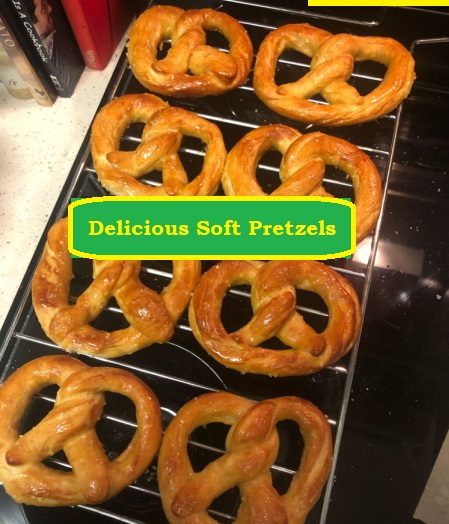
I want to click on type of book, so click(61, 59).